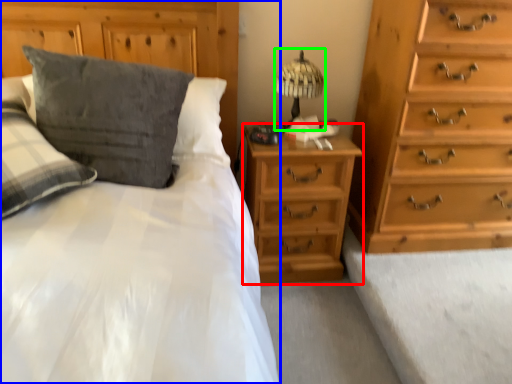
Question: Which is farther away from nightstand (highlighted by a red box)? bed (highlighted by a blue box) or table lamp (highlighted by a green box)?

Choices:
 (A) bed
 (B) table lamp

Answer: (A)